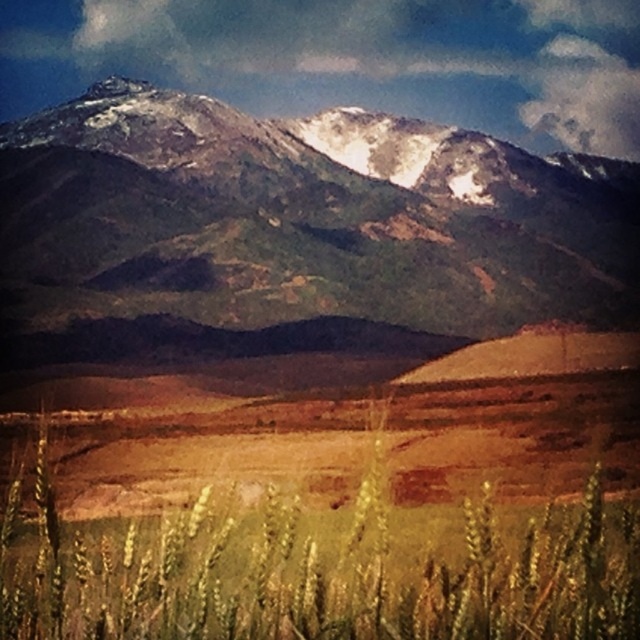
You are standing in the golden matte wheat field at lower center and want to take a photo of the snowy rocky mountain range at upper center. Which direction should you face to capture the mountain range in your view?

You should face to the left to capture the snowy rocky mountain range at upper center since it is positioned to the left of the golden matte wheat field at lower center.